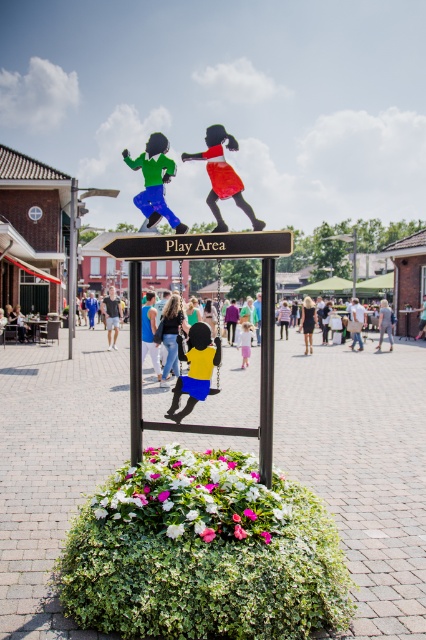
Question: Does matte red skirt at upper center have a lesser width compared to blue denim jeans at center?

Choices:
 (A) yes
 (B) no

Answer: (A)

Question: Which of the following is the closest to the observer?

Choices:
 (A) (104, 307)
 (B) (351, 326)

Answer: (A)

Question: Among these points, which one is nearest to the camera?

Choices:
 (A) (244, 353)
 (B) (233, 244)
 (C) (353, 314)
 (D) (245, 204)

Answer: (B)

Question: Which object appears closest to the camera in this image?

Choices:
 (A) black wood sign at center
 (B) matte red skirt at upper center
 (C) black metal pole at center

Answer: (A)

Question: Considering the relative positions of black metal pole at center and light brown wooden sign at center in the image provided, where is black metal pole at center located with respect to light brown wooden sign at center?

Choices:
 (A) below
 (B) above

Answer: (A)

Question: Is black plastic sign at center behind brushed metal pole at left?

Choices:
 (A) no
 (B) yes

Answer: (A)